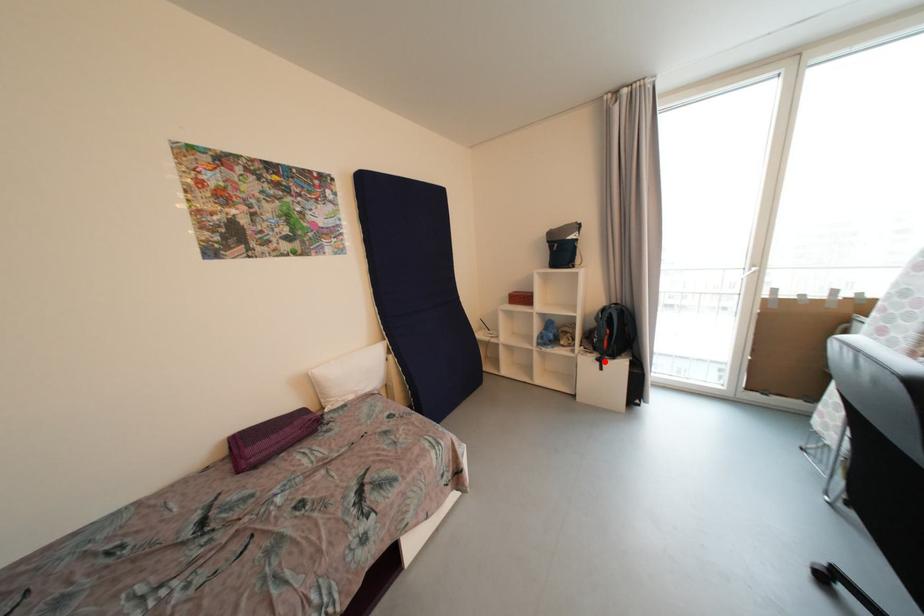
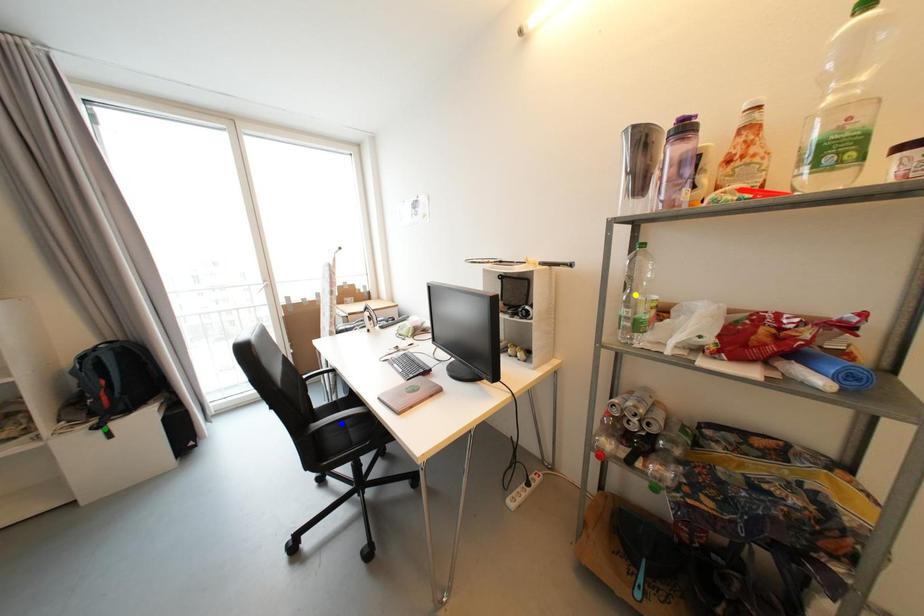
Question: I am providing you with two images of the same scene from different viewpoints. A red point is marked on the first image. You are given multiple points on the second image. In image 2, which mark is for the same physical point as the one in image 1?

Choices:
 (A) blue point
 (B) yellow point
 (C) green point

Answer: (C)